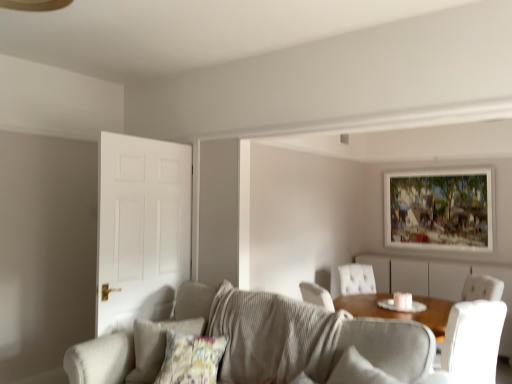
Question: Can wooden dresser at center be found inside white matte door at left?

Choices:
 (A) no
 (B) yes

Answer: (A)

Question: Can you confirm if white matte door at left is positioned to the right of wooden dresser at center?

Choices:
 (A) no
 (B) yes

Answer: (A)

Question: From the image's perspective, is white matte door at left below wooden dresser at center?

Choices:
 (A) no
 (B) yes

Answer: (A)

Question: Is white matte door at left closer to the viewer compared to wooden dresser at center?

Choices:
 (A) no
 (B) yes

Answer: (B)

Question: From the image's perspective, is white matte door at left on wooden dresser at center?

Choices:
 (A) no
 (B) yes

Answer: (B)

Question: Considering the positions of floral fabric pillow at lower left and textured gray couch at center in the image, is floral fabric pillow at lower left wider or thinner than textured gray couch at center?

Choices:
 (A) wide
 (B) thin

Answer: (B)

Question: From a real-world perspective, is floral fabric pillow at lower left physically located above or below textured gray couch at center?

Choices:
 (A) above
 (B) below

Answer: (A)

Question: From the image's perspective, is floral fabric pillow at lower left located above or below textured gray couch at center?

Choices:
 (A) above
 (B) below

Answer: (A)

Question: Choose the correct answer: Is floral fabric pillow at lower left inside textured gray couch at center or outside it?

Choices:
 (A) outside
 (B) inside

Answer: (B)

Question: In terms of width, does white matte door at left look wider or thinner when compared to floral fabric pillow at lower left?

Choices:
 (A) wide
 (B) thin

Answer: (B)

Question: Considering the relative positions of white matte door at left and floral fabric pillow at lower left in the image provided, is white matte door at left to the left or to the right of floral fabric pillow at lower left?

Choices:
 (A) left
 (B) right

Answer: (A)

Question: Looking at the image, does white matte door at left seem bigger or smaller compared to floral fabric pillow at lower left?

Choices:
 (A) small
 (B) big

Answer: (B)

Question: From their relative heights in the image, would you say white matte door at left is taller or shorter than floral fabric pillow at lower left?

Choices:
 (A) tall
 (B) short

Answer: (A)

Question: Considering the positions of point (384, 180) and point (449, 317), is point (384, 180) closer or farther from the camera than point (449, 317)?

Choices:
 (A) closer
 (B) farther

Answer: (B)

Question: From a real-world perspective, is wooden-framed painting at upper right above or below white leather chair at right?

Choices:
 (A) below
 (B) above

Answer: (B)